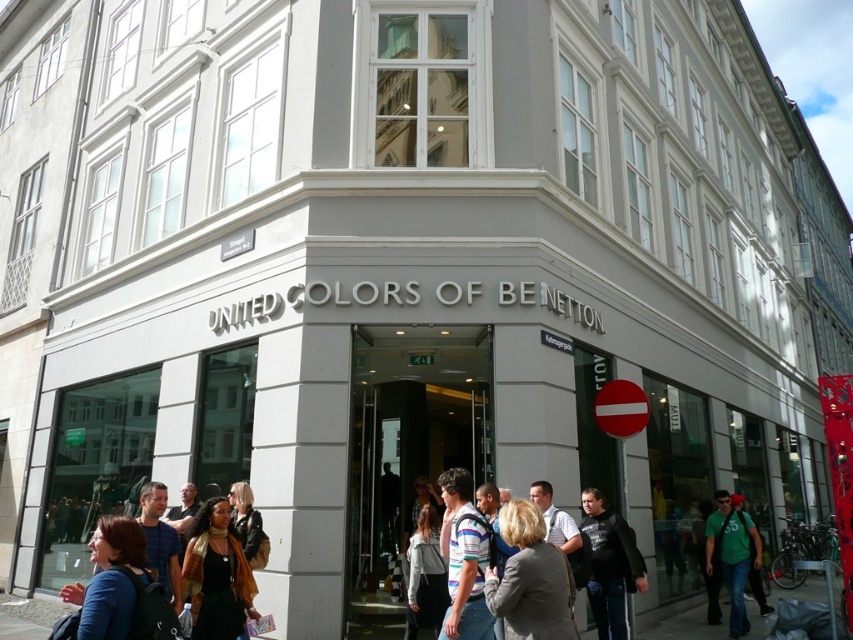
Does point (502, 589) come behind point (640, 573)?

No, (502, 589) is closer to viewer.

Find the location of a particular element. The height and width of the screenshot is (640, 853). gray fabric jacket at center is located at coordinates (x=531, y=579).

Does point (247, 588) come closer to viewer compared to point (694, 632)?

Yes.

Does point (227, 506) come behind point (20, 612)?

No, it is not.

The width and height of the screenshot is (853, 640). In order to click on black leather jacket at lower center in this screenshot , I will do `click(218, 576)`.

Can you confirm if dark gray hoodie at lower center is wider than green matte shirt at lower right?

No, dark gray hoodie at lower center is not wider than green matte shirt at lower right.

Describe the element at coordinates (610, 564) in the screenshot. The width and height of the screenshot is (853, 640). I see `dark gray hoodie at lower center` at that location.

Is point (613, 560) closer to camera compared to point (746, 632)?

Yes, it is in front of point (746, 632).

Identify the location of dark gray hoodie at lower center. (610, 564).